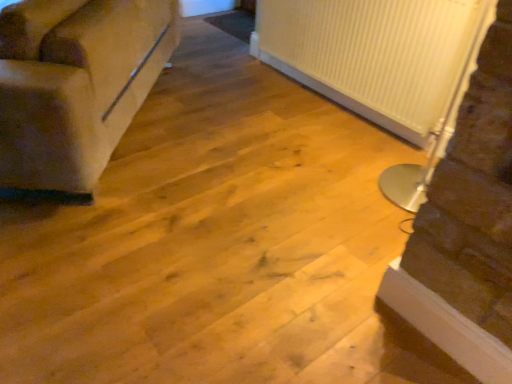
Find the location of a particular element. vacant space positioned to the left of white ribbed radiator at right is located at coordinates (298, 179).